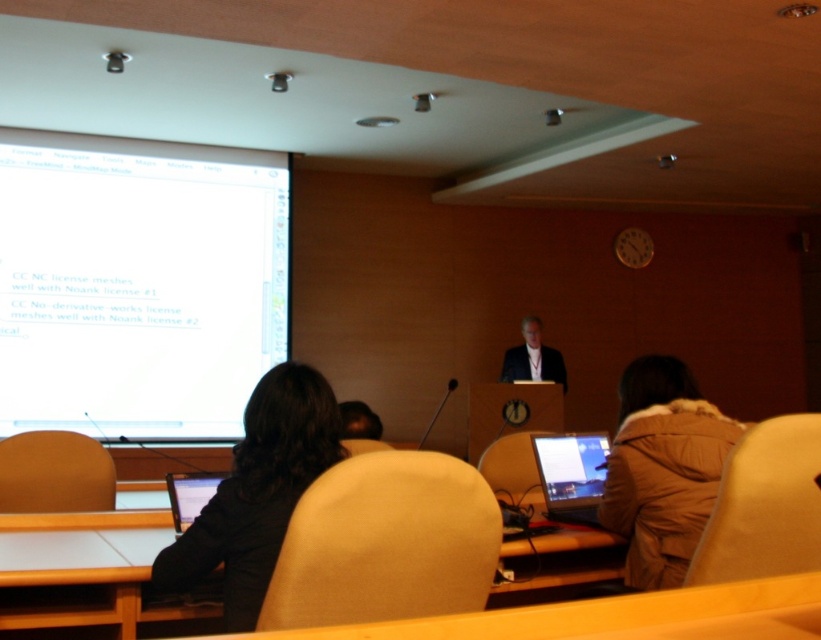
Does point (355, 614) come closer to viewer compared to point (814, 436)?

Yes, point (355, 614) is closer to viewer.

The width and height of the screenshot is (821, 640). Identify the location of smooth beige chair at center. (384, 544).

Where is `smooth beige chair at center`? Image resolution: width=821 pixels, height=640 pixels. smooth beige chair at center is located at coordinates (384, 544).

Looking at this image, can you confirm if matte yellow chair at lower right is positioned to the left of matte plastic chair at center?

Incorrect, matte yellow chair at lower right is not on the left side of matte plastic chair at center.

Which is above, matte yellow chair at lower right or matte plastic chair at center?

matte yellow chair at lower right

Which is behind, point (741, 524) or point (531, 497)?

The point (531, 497) is more distant.

At what (x,y) coordinates should I click in order to perform the action: click on matte yellow chair at lower right. Please return your answer as a coordinate pair (x, y). This screenshot has width=821, height=640. Looking at the image, I should click on (764, 506).

Identify the location of matte plastic chair at center. The width and height of the screenshot is (821, 640). point(512,467).

Find the location of a particular element. The width and height of the screenshot is (821, 640). matte plastic chair at center is located at coordinates (512, 467).

The height and width of the screenshot is (640, 821). Identify the location of matte plastic chair at center. (512, 467).